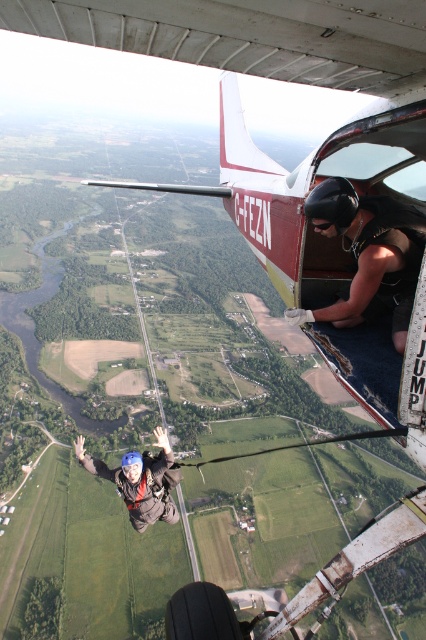
Looking at this image, does black matte helmet at upper right appear on the left side of blue helmeted skydiver at center?

No, black matte helmet at upper right is not to the left of blue helmeted skydiver at center.

This screenshot has height=640, width=426. In order to click on black matte helmet at upper right in this screenshot , I will do `click(368, 256)`.